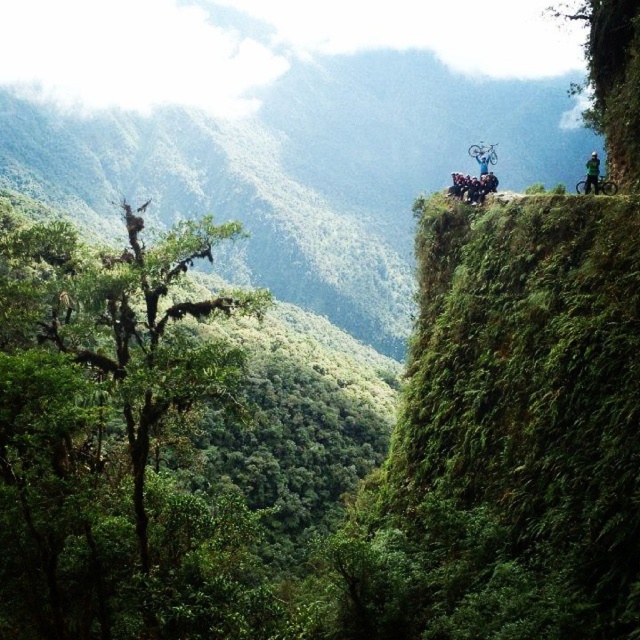
You are standing at the edge of the cliff in the scene and want to take a photo of the green leafy tree at left. If your camera has a maximum zoom range of 10 meters, will you be able to capture the entire tree in the photo without moving closer?

The green leafy tree at left and viewer are 16.99 meters apart, which exceeds the camera maximum zoom range of 10 meters. Therefore, you won